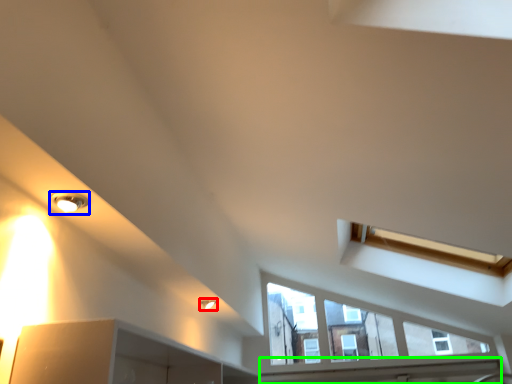
Question: Which object is positioned closest to light fixture (highlighted by a red box)? Select from light fixture (highlighted by a blue box) and window sill (highlighted by a green box).

Choices:
 (A) light fixture
 (B) window sill

Answer: (A)